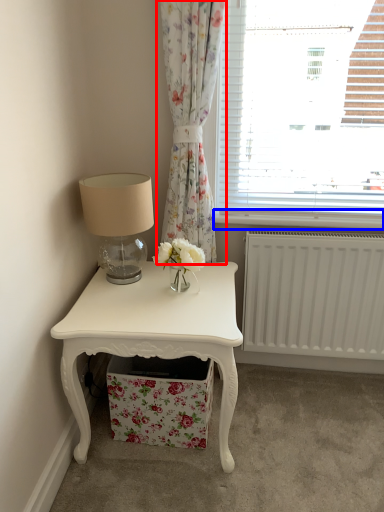
Question: Which of the following is the closest to the observer, curtain (highlighted by a red box) or window sill (highlighted by a blue box)?

Choices:
 (A) curtain
 (B) window sill

Answer: (A)